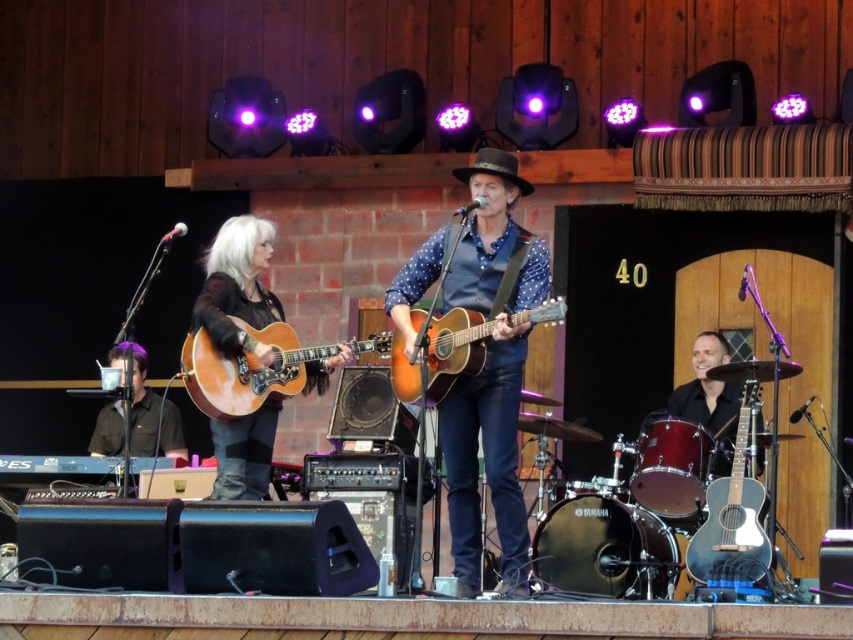
Does matte brown acoustic guitar at center appear over acoustic wood guitar at center?

No, matte brown acoustic guitar at center is not above acoustic wood guitar at center.

Is matte brown acoustic guitar at center wider than acoustic wood guitar at center?

In fact, matte brown acoustic guitar at center might be narrower than acoustic wood guitar at center.

Measure the distance between point (457, 476) and camera.

A distance of 21.93 meters exists between point (457, 476) and camera.

Identify the location of matte brown acoustic guitar at center. Image resolution: width=853 pixels, height=640 pixels. (490, 372).

Which is above, light brown acoustic guitar at center or acoustic wood guitar at center?

acoustic wood guitar at center is higher up.

From the picture: Who is shorter, light brown acoustic guitar at center or acoustic wood guitar at center?

acoustic wood guitar at center

Locate an element on the screen. light brown acoustic guitar at center is located at coordinates (247, 369).

Looking at this image, is matte brown acoustic guitar at center thinner than matte blue acoustic guitar at lower right?

No.

The image size is (853, 640). What are the coordinates of `matte brown acoustic guitar at center` in the screenshot? It's located at (490, 372).

Where is `matte brown acoustic guitar at center`? matte brown acoustic guitar at center is located at coordinates (x=490, y=372).